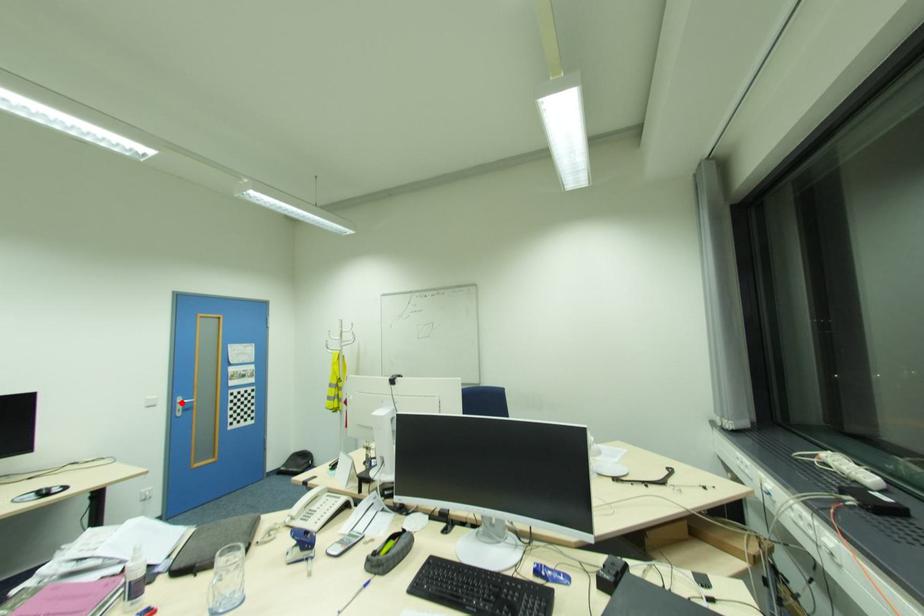
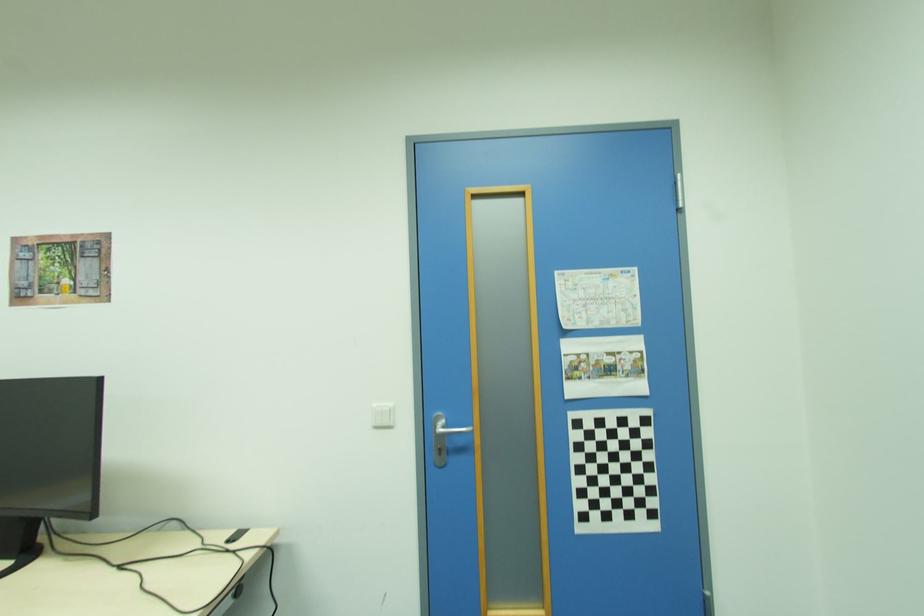
Locate, in the second image, the point that corresponds to the highlighted location in the first image.

(439, 429)